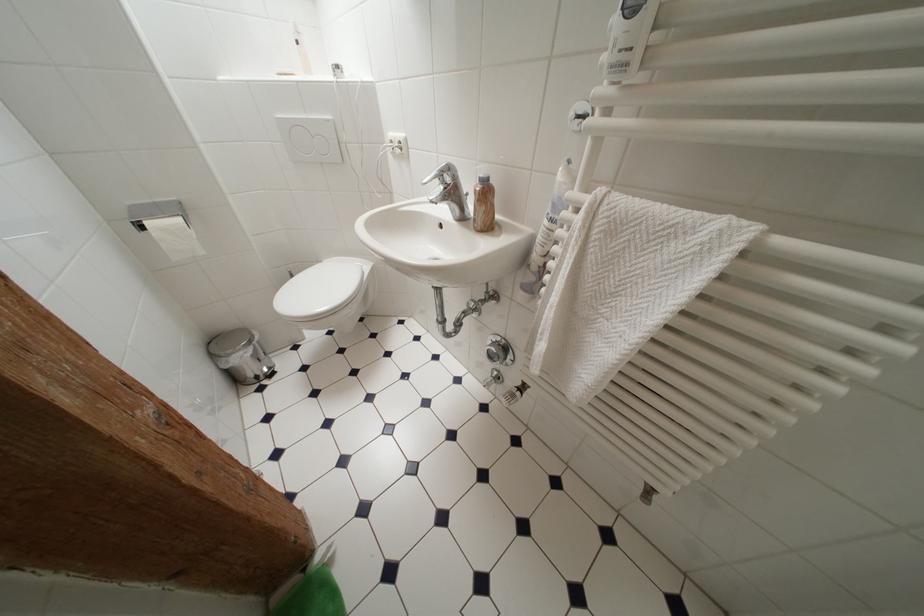
Where is `toilet flush button`? Image resolution: width=924 pixels, height=616 pixels. toilet flush button is located at coordinates (310, 139).